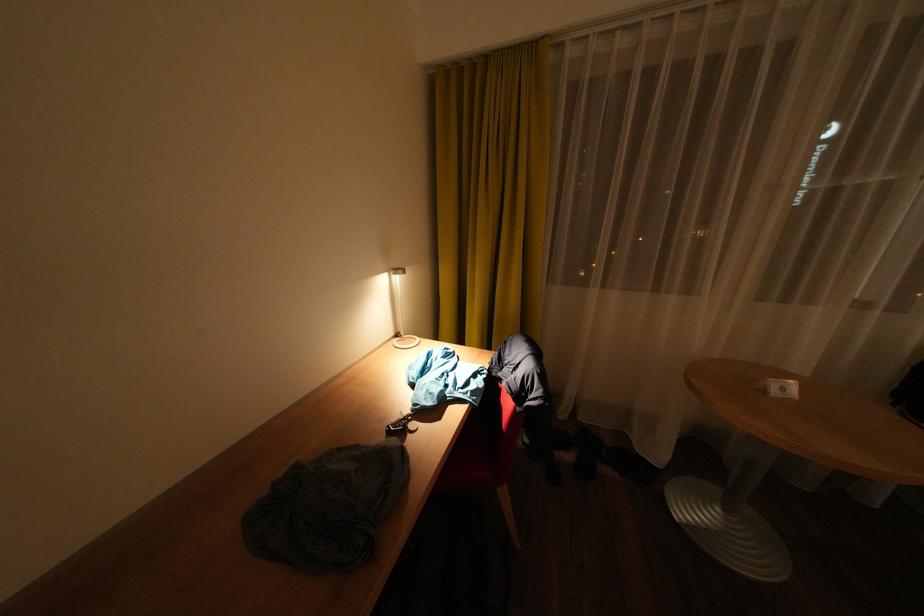
Where is `chair sitting surface`? This screenshot has height=616, width=924. chair sitting surface is located at coordinates point(476,448).